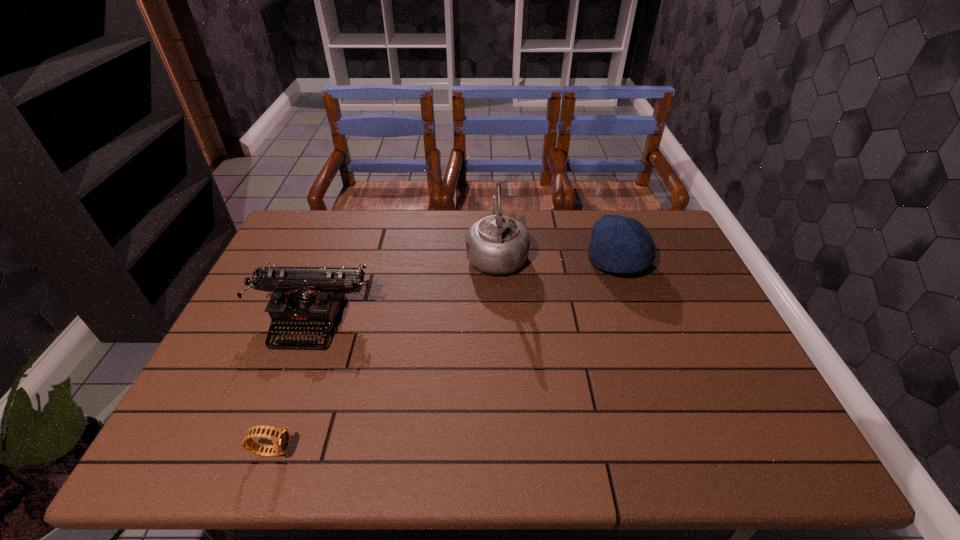
Locate an element on the screen. The height and width of the screenshot is (540, 960). free space between the second object from right to left and the shortest object is located at coordinates (384, 352).

At what (x,y) coordinates should I click in order to perform the action: click on free point between the shortest object and the tallest object. Please return your answer as a coordinate pair (x, y). The image size is (960, 540). Looking at the image, I should click on (384, 352).

This screenshot has height=540, width=960. What are the coordinates of `free area in between the watch and the rightmost object` in the screenshot? It's located at (444, 356).

Where is `object that is the third nearest to the skullcap`? This screenshot has height=540, width=960. object that is the third nearest to the skullcap is located at coordinates (280, 437).

Choose which object is the nearest neighbor to the kettle. Please provide its 2D coordinates. Your answer should be formatted as a tuple, i.e. [(x, y)], where the tuple contains the x and y coordinates of a point satisfying the conditions above.

[(618, 244)]

The height and width of the screenshot is (540, 960). Identify the location of free spot that satisfies the following two spatial constraints: 1. on the front side of the skullcap; 2. on the face of the nearest object. (685, 450).